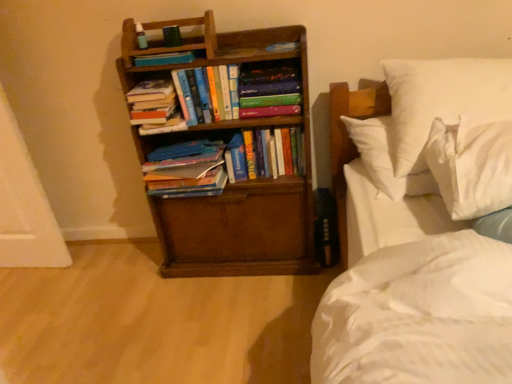
Locate an element on the screen. The width and height of the screenshot is (512, 384). empty space that is ontop of hardcover books at center, the 4th book from the left (from a real-world perspective) is located at coordinates (258, 126).